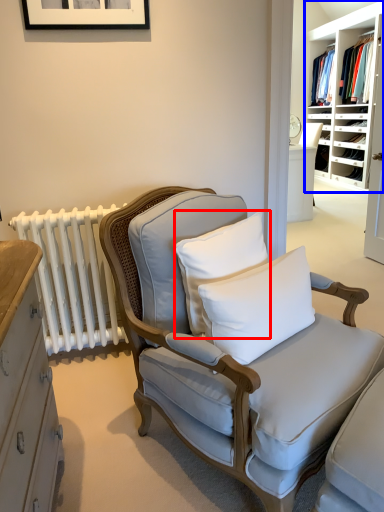
Question: Among these objects, which one is farthest to the camera, pillow (highlighted by a red box) or shelf (highlighted by a blue box)?

Choices:
 (A) pillow
 (B) shelf

Answer: (B)